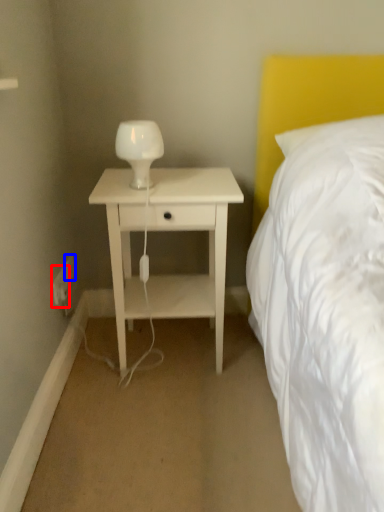
Question: Which object is further to the camera taking this photo, electric outlet (highlighted by a red box) or electric outlet (highlighted by a blue box)?

Choices:
 (A) electric outlet
 (B) electric outlet

Answer: (B)